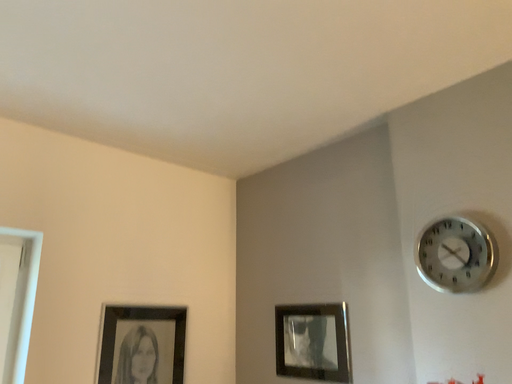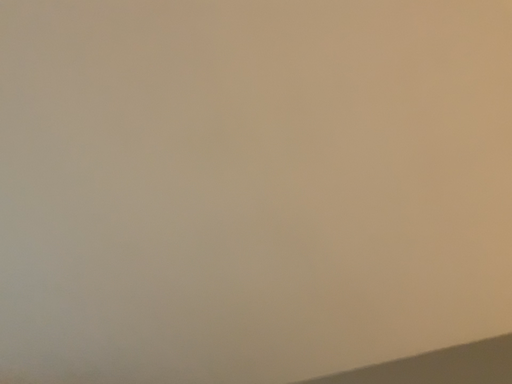
Question: Which way did the camera rotate in the video?

Choices:
 (A) rotated left
 (B) rotated right

Answer: (B)